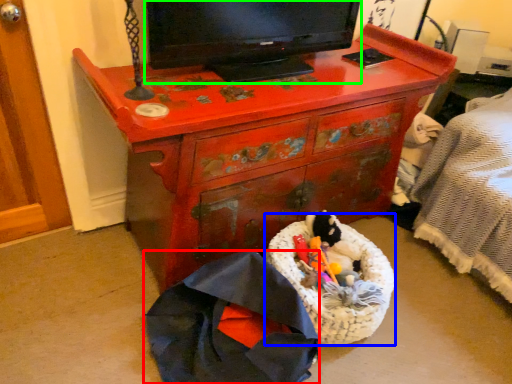
Question: Which object is positioned farthest from clothing (highlighted by a red box)? Select from laundry basket (highlighted by a blue box) and television (highlighted by a green box).

Choices:
 (A) laundry basket
 (B) television

Answer: (B)